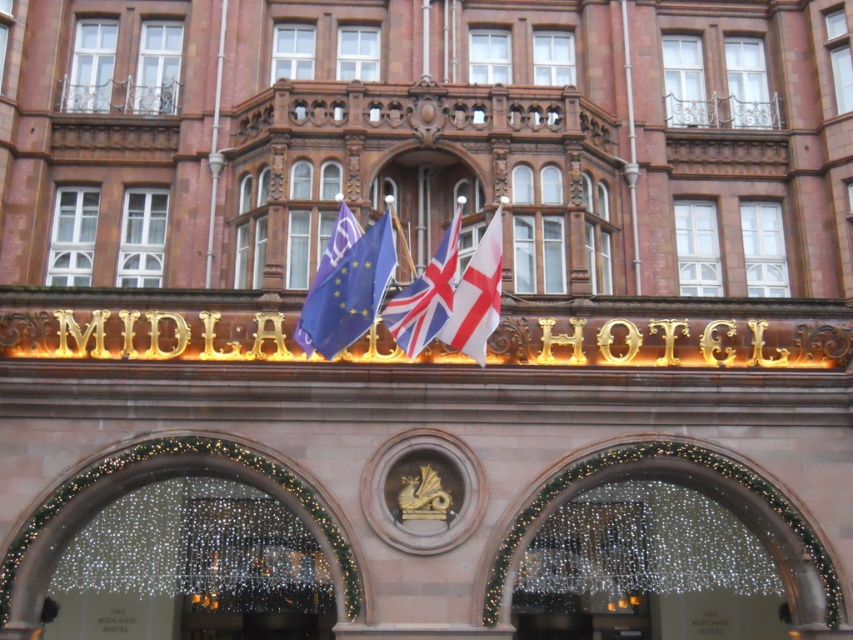
Between point (492, 248) and point (434, 300), which one is positioned in front?

Point (434, 300) is in front.

Does white fabric flag at center appear under polyester flag at center?

Yes, white fabric flag at center is below polyester flag at center.

Between point (483, 330) and point (422, 285), which one is positioned behind?

The point (422, 285) is more distant.

This screenshot has height=640, width=853. What are the coordinates of `white fabric flag at center` in the screenshot? It's located at (477, 296).

Is blue fabric flag at center smaller than polyester flag at center?

Yes, blue fabric flag at center is smaller than polyester flag at center.

Is point (370, 244) positioned after point (456, 250)?

Yes, it is behind point (456, 250).

Is point (311, 324) closer to camera compared to point (381, 314)?

Yes, it is.

I want to click on blue fabric flag at center, so (347, 292).

Between blue fabric flag at center and white fabric flag at center, which one has less height?

blue fabric flag at center

Find the location of a particular element. The width and height of the screenshot is (853, 640). blue fabric flag at center is located at coordinates (347, 292).

Between point (354, 307) and point (497, 230), which one is positioned behind?

The point (497, 230) is behind.

The image size is (853, 640). Find the location of `blue fabric flag at center`. blue fabric flag at center is located at coordinates (347, 292).